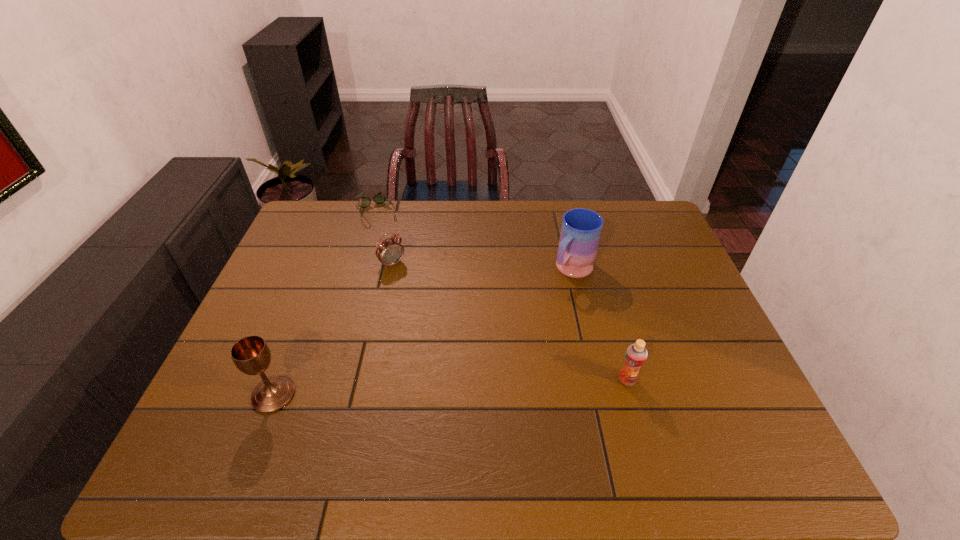
The height and width of the screenshot is (540, 960). In order to click on vacant space on the desktop that is between the chalice and the third shortest object and is positioned on the face of the alarm clock in this screenshot , I will do `click(502, 385)`.

Image resolution: width=960 pixels, height=540 pixels. Find the location of `vacant space on the desktop that is between the chalice and the orange juice and is positioned on the front-facing side of the spectacles`. vacant space on the desktop that is between the chalice and the orange juice and is positioned on the front-facing side of the spectacles is located at coordinates (468, 387).

Find the location of `free space on the desktop that is between the chalice and the orange juice and is positioned on the side of the mug with the handle`. free space on the desktop that is between the chalice and the orange juice and is positioned on the side of the mug with the handle is located at coordinates (460, 387).